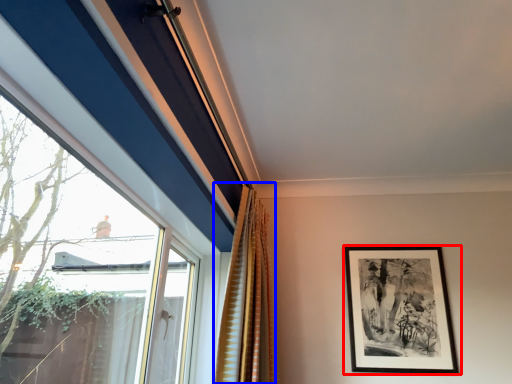
Question: Which of the following is the farthest to the observer, picture frame (highlighted by a red box) or curtain (highlighted by a blue box)?

Choices:
 (A) picture frame
 (B) curtain

Answer: (A)